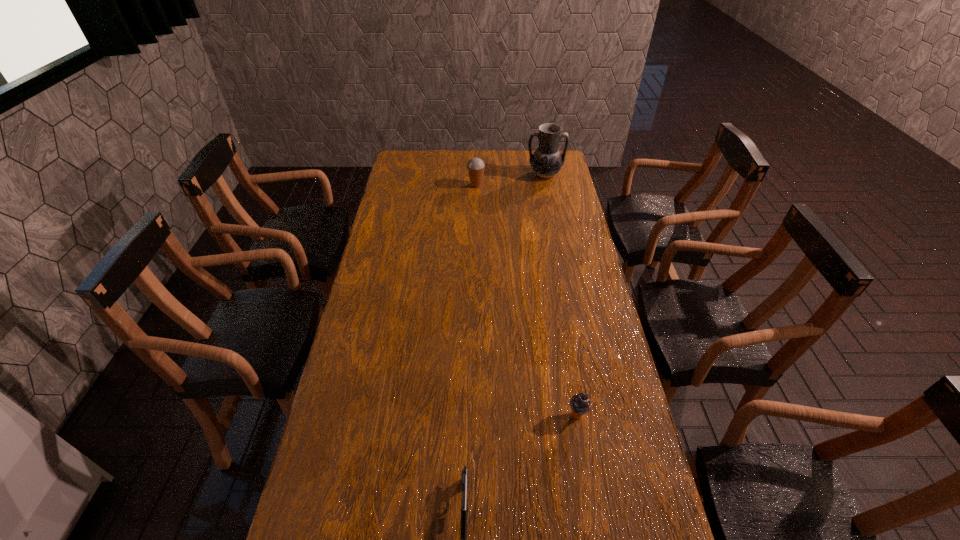
Where is `the tallest object`? This screenshot has height=540, width=960. the tallest object is located at coordinates (546, 162).

Locate an element on the screen. the taller icecream is located at coordinates (475, 166).

Find the location of `the farther icecream`. the farther icecream is located at coordinates (475, 166).

Locate an element on the screen. Image resolution: width=960 pixels, height=540 pixels. the nearer icecream is located at coordinates (580, 404).

Locate an element on the screen. the shorter icecream is located at coordinates (580, 404).

Identify the location of vacant space located 0.170m on the front-facing side of the tallest object. The height and width of the screenshot is (540, 960). (551, 203).

This screenshot has width=960, height=540. In order to click on free space located 0.350m on the right of the second tallest object in this screenshot , I will do `click(559, 185)`.

This screenshot has width=960, height=540. I want to click on vacant area situated 0.050m on the left of the shorter icecream, so click(x=549, y=416).

At what (x,y) coordinates should I click in order to perform the action: click on object that is positioned at the far edge. Please return your answer as a coordinate pair (x, y). Looking at the image, I should click on (546, 162).

The image size is (960, 540). Identify the location of pitcher at the right edge. (546, 162).